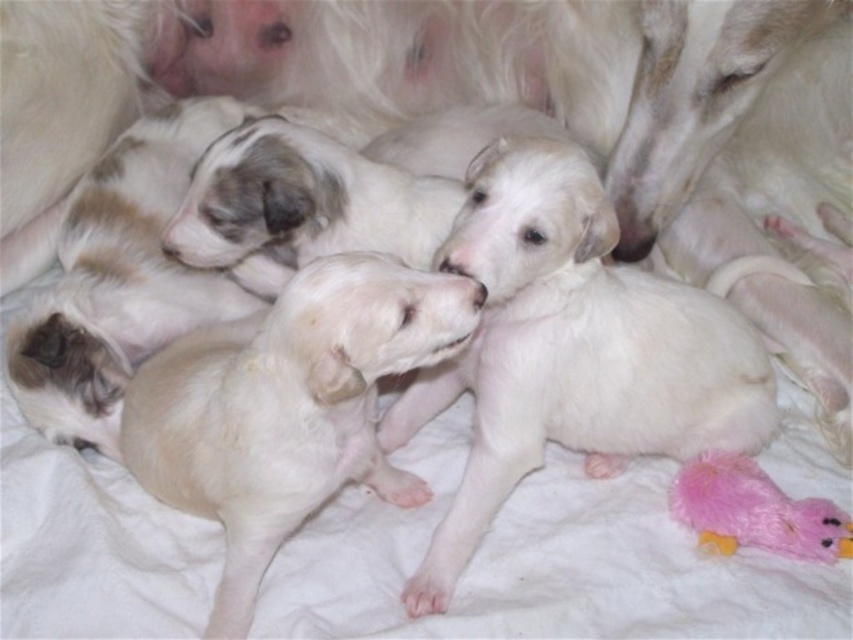
Who is taller, white fluffy puppy at center or fuzzy pink plush at lower right?

white fluffy puppy at center is taller.

In the scene shown: Between white fluffy puppy at center and fuzzy pink plush at lower right, which one appears on the left side from the viewer's perspective?

white fluffy puppy at center

Image resolution: width=853 pixels, height=640 pixels. I want to click on white fluffy puppy at center, so click(x=573, y=348).

I want to click on white fluffy puppy at center, so click(573, 348).

Between point (180, 467) and point (676, 493), which one is positioned in front?

Point (180, 467) is in front.

Does white soft fur puppy at center have a lesser width compared to fuzzy pink plush at lower right?

No, white soft fur puppy at center is not thinner than fuzzy pink plush at lower right.

Is point (344, 426) positioned before point (674, 493)?

That is True.

At what (x,y) coordinates should I click in order to perform the action: click on white soft fur puppy at center. Please return your answer as a coordinate pair (x, y). The height and width of the screenshot is (640, 853). Looking at the image, I should click on (287, 406).

Does white fluffy puppy at center have a lesser height compared to white soft fur puppy at center?

Incorrect, white fluffy puppy at center's height does not fall short of white soft fur puppy at center's.

In the scene shown: Can you confirm if white fluffy puppy at center is thinner than white soft fur puppy at center?

No.

You are a GUI agent. You are given a task and a screenshot of the screen. Output one action in this format:
    pyautogui.click(x=<x>, y=<y>)
    Task: Click on the white fluffy puppy at center
    This screenshot has height=640, width=853.
    Given the screenshot: What is the action you would take?
    pyautogui.click(x=573, y=348)